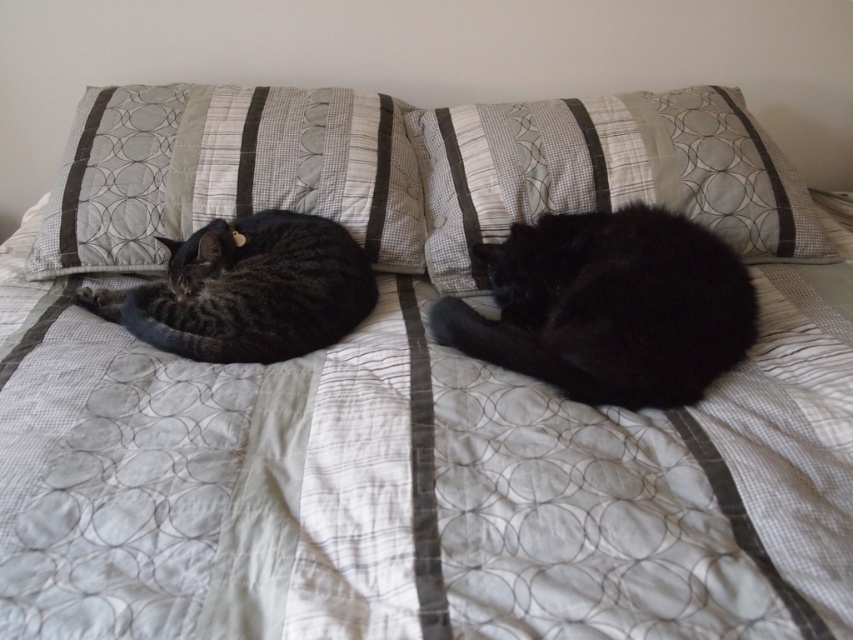
You are trying to place a small toy between the textured fabric pillow at center and the black silky cat at center on the bed. Based on their sizes, which one will you place the toy closer to?

The textured fabric pillow at center is larger in size than the black silky cat at center, so you should place the toy closer to the pillow to ensure there is enough space.

Consider the image. You are trying to place a new decorative item on the bed. Given the current arrangement, can the textured fabric pillow at upper left fit next to the black silky cat at center without overlapping?

The textured fabric pillow at upper left is wider than the black silky cat at center, so there might be enough space for the pillow next to the cat if the cat moves or if the pillow is positioned carefully. However, since the pillow is larger in width, it could potentially overlap unless adjusted.